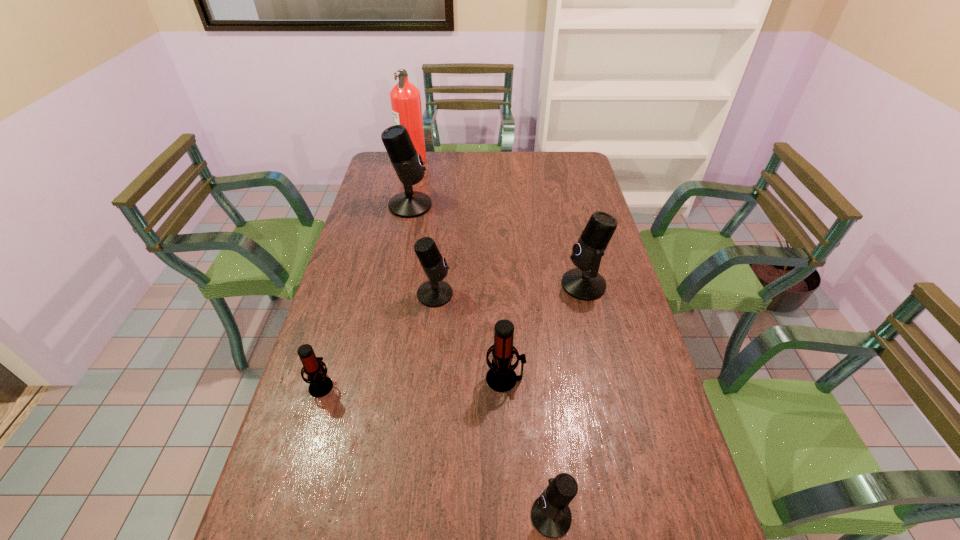
This screenshot has width=960, height=540. What are the coordinates of `the nearest object` in the screenshot? It's located at (551, 516).

You are a GUI agent. You are given a task and a screenshot of the screen. Output one action in this format:
    pyautogui.click(x=<x>, y=<y>)
    Task: Click on the nearest black microphone
    The image size is (960, 540).
    Given the screenshot: What is the action you would take?
    pyautogui.click(x=551, y=516)

Find the location of a particular element. This screenshot has width=960, height=540. blank space located at the nozzle of the fire extinguisher is located at coordinates (513, 160).

Find the location of `free point located 0.400m on the stand of the farthest black microphone`. free point located 0.400m on the stand of the farthest black microphone is located at coordinates (533, 206).

Locate an element on the screen. The height and width of the screenshot is (540, 960). vacant space located on the stand of the rightmost black microphone is located at coordinates (527, 285).

This screenshot has width=960, height=540. Find the location of `free space located on the stand of the rightmost black microphone`. free space located on the stand of the rightmost black microphone is located at coordinates point(499,285).

The width and height of the screenshot is (960, 540). Identify the location of free space located on the stand of the rightmost black microphone. (527, 285).

Find the location of a particular element. The height and width of the screenshot is (540, 960). vacant space situated 0.090m on the stand of the third biggest black microphone is located at coordinates (481, 294).

This screenshot has width=960, height=540. In order to click on free point located on the back of the bigger red microphone in this screenshot , I will do `click(503, 336)`.

At what (x,y) coordinates should I click in order to perform the action: click on vacant area situated 0.080m on the back of the leftmost microphone. Please return your answer as a coordinate pair (x, y). Image resolution: width=960 pixels, height=540 pixels. Looking at the image, I should click on (332, 348).